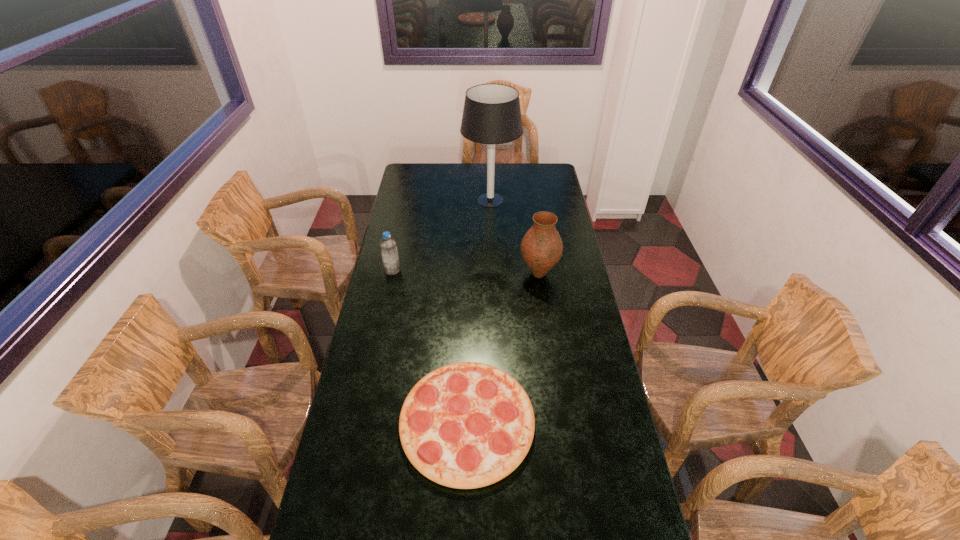
I want to click on the farthest object, so click(491, 115).

Find the location of `the tallest object`. the tallest object is located at coordinates (491, 115).

The width and height of the screenshot is (960, 540). What are the coordinates of `the second tallest object` in the screenshot? It's located at (541, 248).

This screenshot has width=960, height=540. Identify the location of the second shortest object. (388, 246).

This screenshot has height=540, width=960. I want to click on water bottle, so click(388, 246).

Image resolution: width=960 pixels, height=540 pixels. What are the coordinates of `the shortest object` in the screenshot? It's located at (466, 425).

Where is `the nearest object`? The height and width of the screenshot is (540, 960). the nearest object is located at coordinates (466, 425).

This screenshot has width=960, height=540. I want to click on vacant space located on the front of the table lamp, so click(x=492, y=244).

Where is `vacant space situated on the back of the third shortest object`? vacant space situated on the back of the third shortest object is located at coordinates click(x=535, y=247).

I want to click on vacant space located 0.250m on the right of the third tallest object, so click(460, 270).